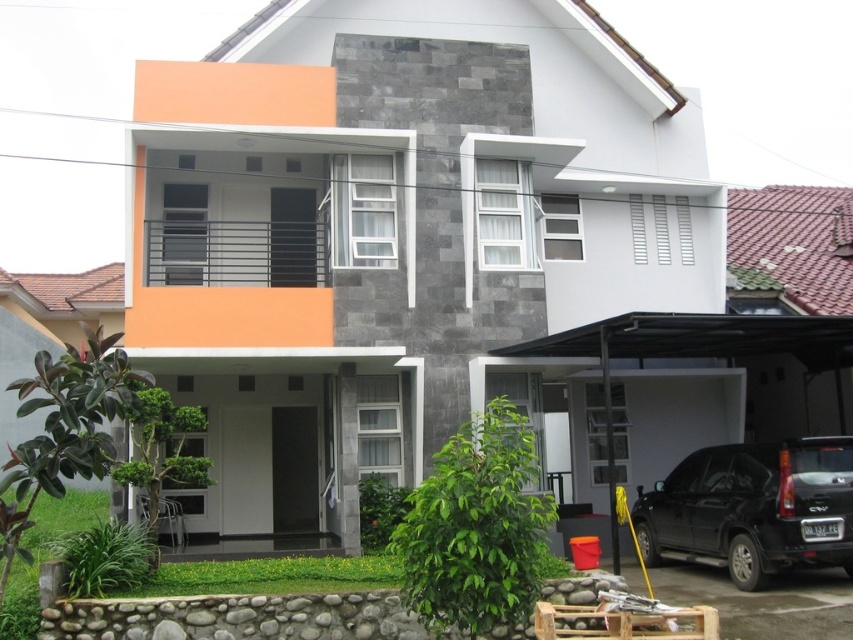
Question: From the image, what is the correct spatial relationship of white concrete garage at lower right in relation to black matte suv at lower right?

Choices:
 (A) right
 (B) left

Answer: (B)

Question: Among these points, which one is farthest from the camera?

Choices:
 (A) tap(230, 513)
 (B) tap(741, 476)

Answer: (A)

Question: Which object appears closest to the camera in this image?

Choices:
 (A) white concrete garage at lower right
 (B) black matte suv at lower right

Answer: (B)

Question: Is the position of white concrete garage at lower right more distant than that of black matte suv at lower right?

Choices:
 (A) no
 (B) yes

Answer: (B)

Question: Is white concrete garage at lower right in front of black matte suv at lower right?

Choices:
 (A) yes
 (B) no

Answer: (B)